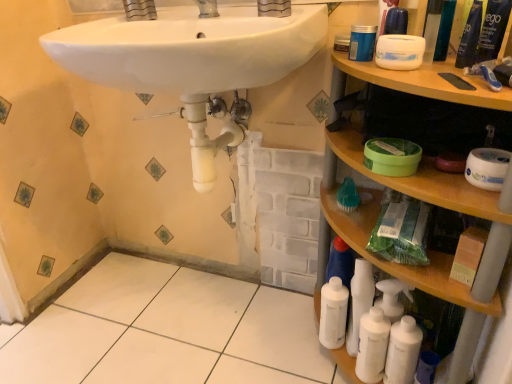
The width and height of the screenshot is (512, 384). In order to click on vacant area that is in front of white glossy tap at upper center in this screenshot , I will do `click(204, 26)`.